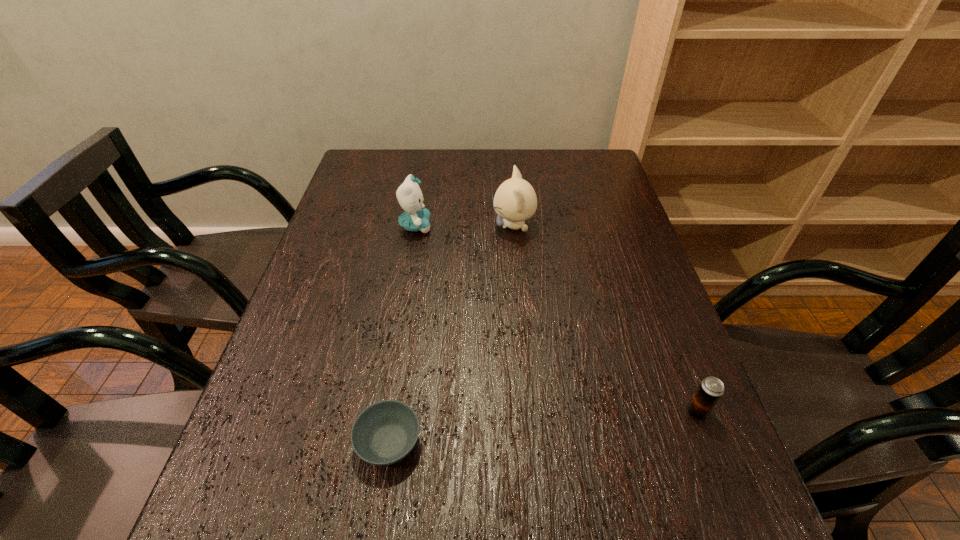
Find the location of `vacant space located on the right of the soup bowl`. vacant space located on the right of the soup bowl is located at coordinates (485, 442).

The width and height of the screenshot is (960, 540). Identify the location of object that is positioned at the right edge. (711, 389).

Image resolution: width=960 pixels, height=540 pixels. What are the coordinates of `free spot at the far edge of the desktop` in the screenshot? It's located at (416, 148).

The image size is (960, 540). What are the coordinates of `vacant space at the near edge of the desktop` in the screenshot? It's located at (312, 526).

Identify the location of vacant space at the left edge of the desktop. (292, 316).

Locate an element on the screen. This screenshot has height=540, width=960. vacant space at the right edge of the desktop is located at coordinates (588, 214).

I want to click on free space at the far left corner of the desktop, so click(354, 179).

Locate an element on the screen. vacant area at the far right corner of the desktop is located at coordinates (610, 175).

Where is `free space that is in between the shortest object and the rightmost object`? free space that is in between the shortest object and the rightmost object is located at coordinates (543, 427).

What are the coordinates of `empty space that is in between the rightmost object and the right kitten` in the screenshot? It's located at (606, 319).